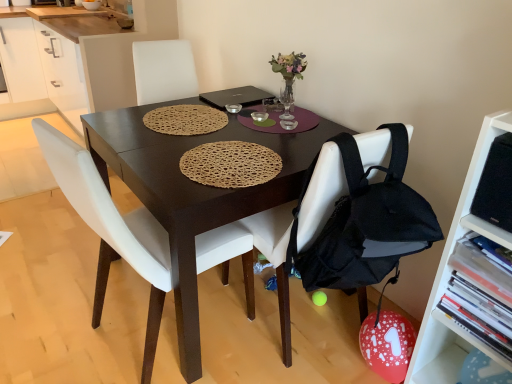
Question: Is black matte laptop at center surrounding dark wood table at center?

Choices:
 (A) yes
 (B) no

Answer: (B)

Question: From a real-world perspective, is black matte laptop at center beneath dark wood table at center?

Choices:
 (A) yes
 (B) no

Answer: (B)

Question: Is black matte laptop at center far away from dark wood table at center?

Choices:
 (A) yes
 (B) no

Answer: (B)

Question: Is black matte laptop at center positioned beyond the bounds of dark wood table at center?

Choices:
 (A) yes
 (B) no

Answer: (B)

Question: Is black matte laptop at center facing towards dark wood table at center?

Choices:
 (A) yes
 (B) no

Answer: (A)

Question: Does black matte laptop at center have a lesser width compared to dark wood table at center?

Choices:
 (A) no
 (B) yes

Answer: (B)

Question: Is white plastic shelf at right wider than woven brown placemat at center?

Choices:
 (A) yes
 (B) no

Answer: (B)

Question: Considering the relative sizes of white plastic shelf at right and woven brown placemat at center in the image provided, is white plastic shelf at right bigger than woven brown placemat at center?

Choices:
 (A) yes
 (B) no

Answer: (A)

Question: Does white plastic shelf at right turn towards woven brown placemat at center?

Choices:
 (A) yes
 (B) no

Answer: (B)

Question: Considering the relative sizes of white plastic shelf at right and woven brown placemat at center in the image provided, is white plastic shelf at right smaller than woven brown placemat at center?

Choices:
 (A) no
 (B) yes

Answer: (A)

Question: From the image's perspective, is white plastic shelf at right located beneath woven brown placemat at center?

Choices:
 (A) no
 (B) yes

Answer: (B)

Question: Does white plastic shelf at right have a lesser width compared to woven brown placemat at center?

Choices:
 (A) no
 (B) yes

Answer: (B)

Question: Is black matte laptop at center at the back of white plastic shelf at right?

Choices:
 (A) yes
 (B) no

Answer: (B)